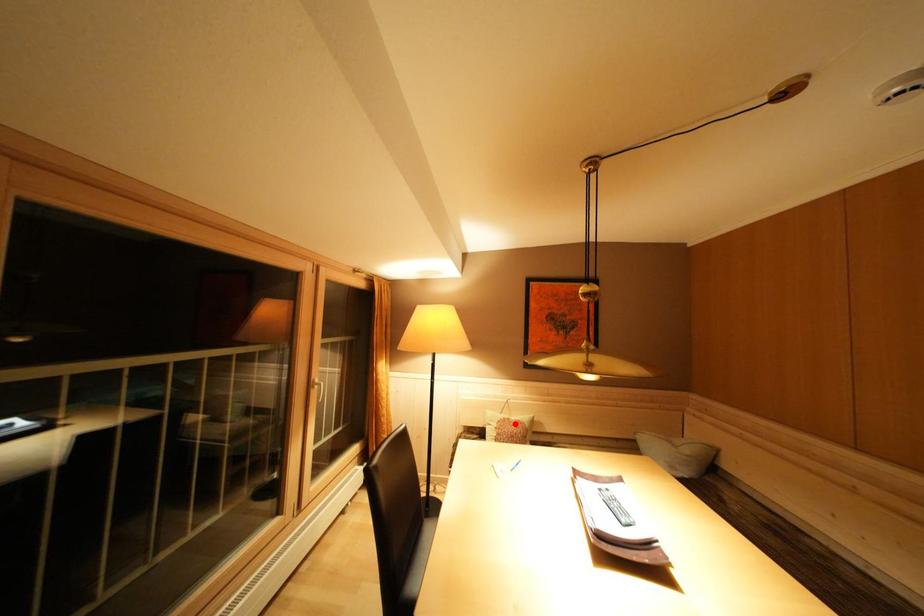
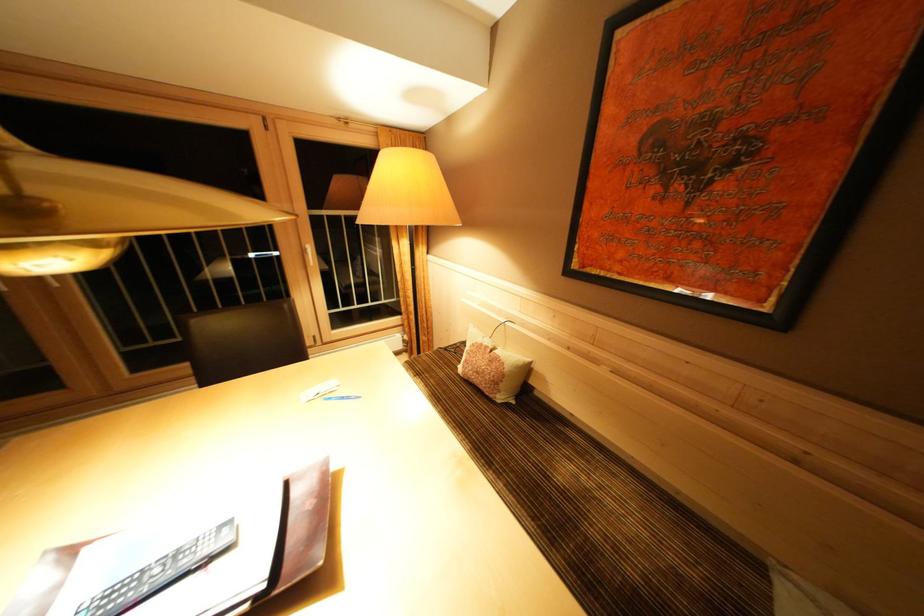
Where in the second image is the point corresponding to the highlighted location from the first image?

(493, 352)